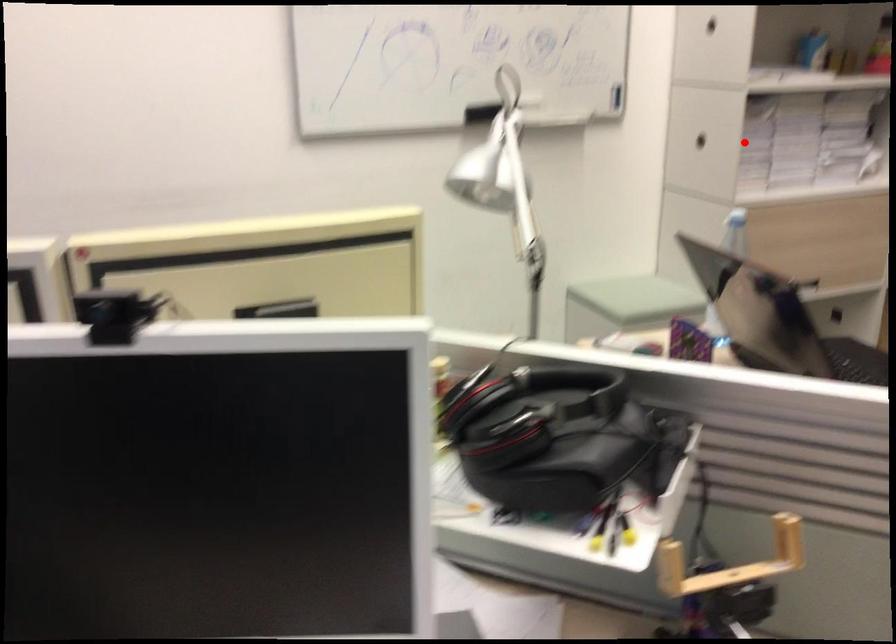
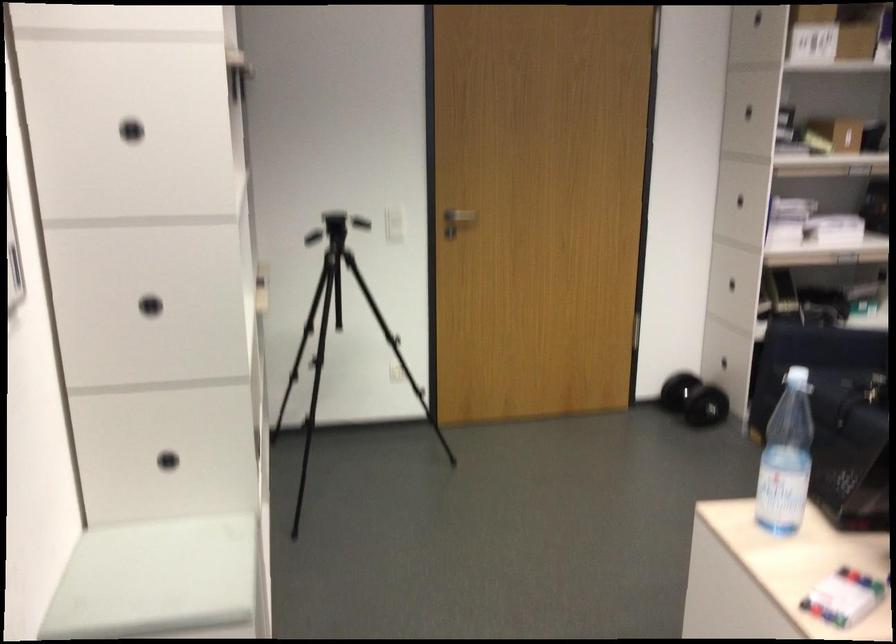
In the second image, find the point that corresponds to the highlighted location in the first image.

(150, 305)